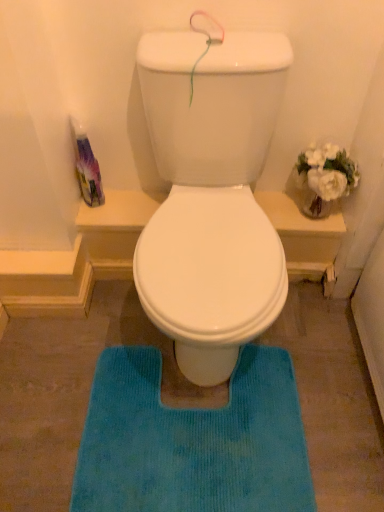
The image size is (384, 512). Find the location of `free space above blue textured bath mat at center (from a real-world perspective)`. free space above blue textured bath mat at center (from a real-world perspective) is located at coordinates (182, 419).